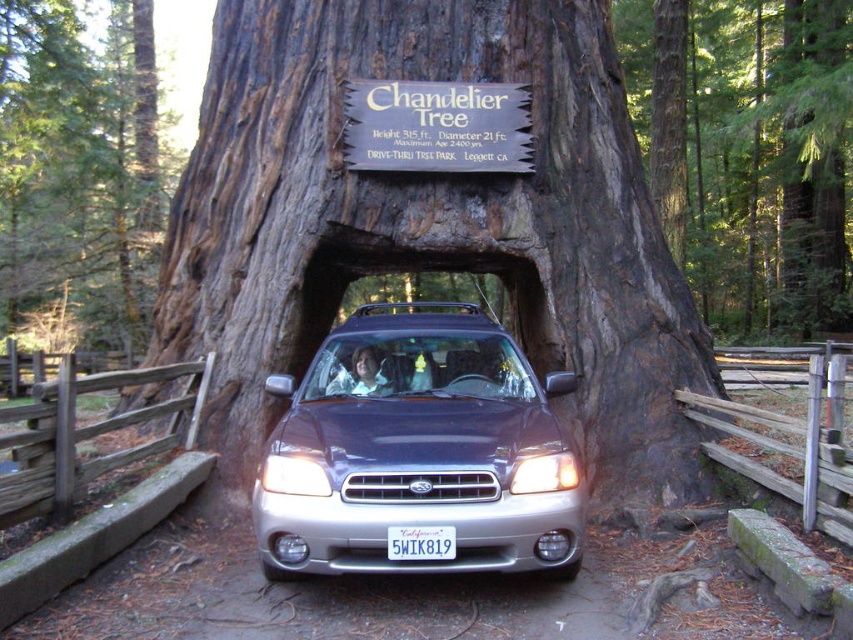
Question: Observing the image, what is the correct spatial positioning of dark brown wood at center in reference to white plastic license plate at center?

Choices:
 (A) below
 (B) above

Answer: (B)

Question: Is smooth bark tree at center positioned behind dark brown bark tree at center?

Choices:
 (A) yes
 (B) no

Answer: (B)

Question: Which of these objects is positioned farthest from the smooth bark tree at center?

Choices:
 (A) white plastic license plate at center
 (B) dark brown bark tree at center
 (C) satin silver suv at center

Answer: (B)

Question: Which point is farther to the camera?

Choices:
 (A) dark brown wood at center
 (B) white plastic license plate at center
 (C) satin silver suv at center

Answer: (A)

Question: Can you confirm if dark brown wood at center is positioned below white plastic license plate at center?

Choices:
 (A) yes
 (B) no

Answer: (B)

Question: Which is farther from the dark brown bark tree at center?

Choices:
 (A) dark brown wood at center
 (B) satin silver suv at center

Answer: (B)